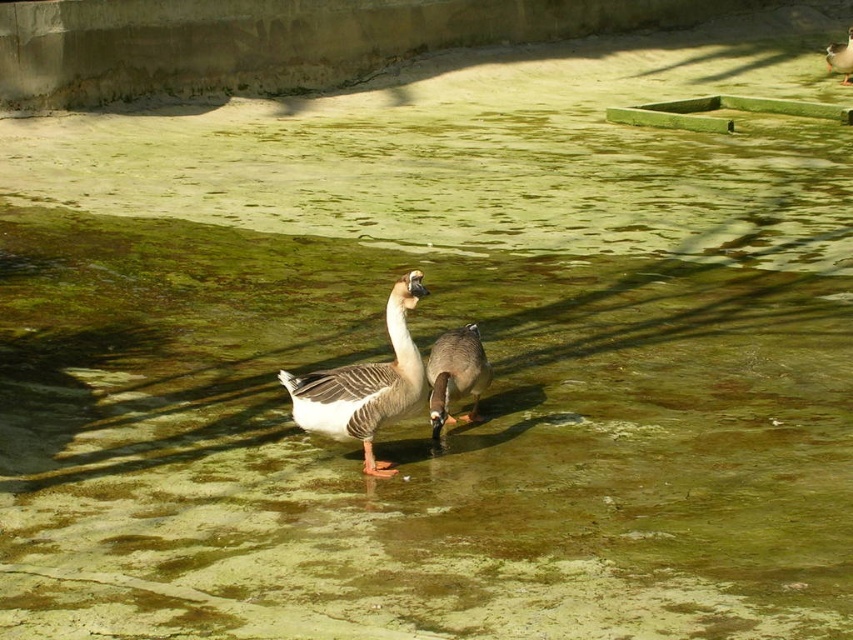
Does white-gray feathered duck at center appear over brown speckled duck at center?

Yes.

Does white-gray feathered duck at center have a smaller size compared to brown speckled duck at center?

No.

Who is more distant from viewer, (279, 374) or (445, 380)?

Point (445, 380)

In order to click on white-gray feathered duck at center in this screenshot , I will do `click(364, 385)`.

Looking at this image, who is more forward, (447, 404) or (827, 45)?

Point (447, 404) is in front.

Based on the photo, is the position of brown speckled duck at center less distant than that of brown matte duck at upper right?

Yes.

Find the location of a particular element. brown speckled duck at center is located at coordinates (456, 374).

Find the location of a particular element. This screenshot has width=853, height=640. brown speckled duck at center is located at coordinates coord(456,374).

Does white-gray feathered duck at center have a lesser width compared to brown matte duck at upper right?

Incorrect, white-gray feathered duck at center's width is not less than brown matte duck at upper right's.

Is point (318, 380) positioned before point (839, 45)?

Yes, point (318, 380) is in front of point (839, 45).

Locate an element on the screen. This screenshot has height=640, width=853. white-gray feathered duck at center is located at coordinates (364, 385).

Identify the location of white-gray feathered duck at center. (364, 385).